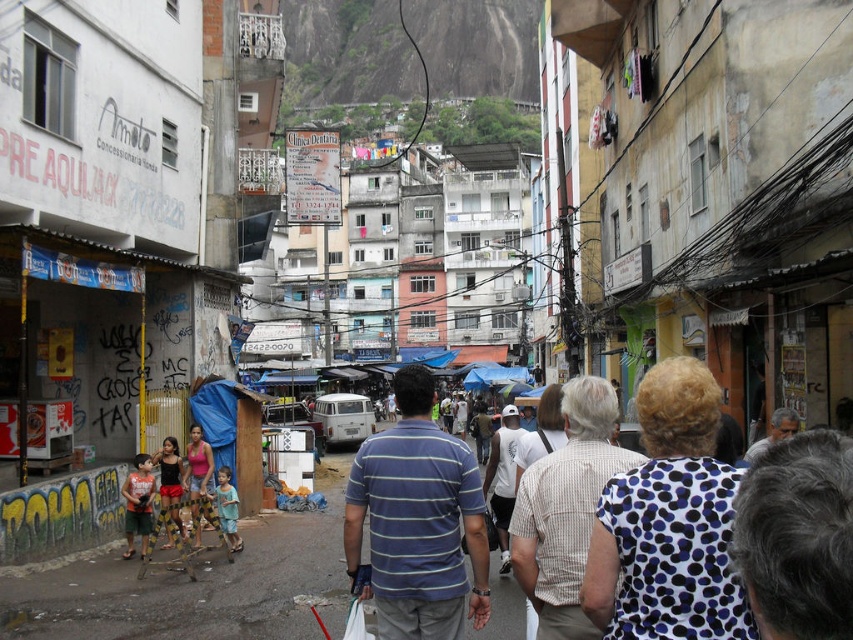
Is orange striped shirt at center below light blue striped shirt at center?

Incorrect, orange striped shirt at center is not positioned below light blue striped shirt at center.

Is orange striped shirt at center to the left of light blue striped shirt at center from the viewer's perspective?

Yes, orange striped shirt at center is to the left of light blue striped shirt at center.

What are the coordinates of `orange striped shirt at center` in the screenshot? It's located at (138, 502).

Does beige striped shirt at center appear on the right side of orange striped shirt at center?

Correct, you'll find beige striped shirt at center to the right of orange striped shirt at center.

This screenshot has height=640, width=853. I want to click on beige striped shirt at center, so click(x=566, y=508).

Is point (614, 516) closer to camera compared to point (416, 394)?

Yes, it is in front of point (416, 394).

The height and width of the screenshot is (640, 853). Identify the location of white dotted shirt at center. (668, 522).

Which is behind, point (689, 396) or point (378, 634)?

Positioned behind is point (378, 634).

Locate an element on the screen. white dotted shirt at center is located at coordinates (668, 522).